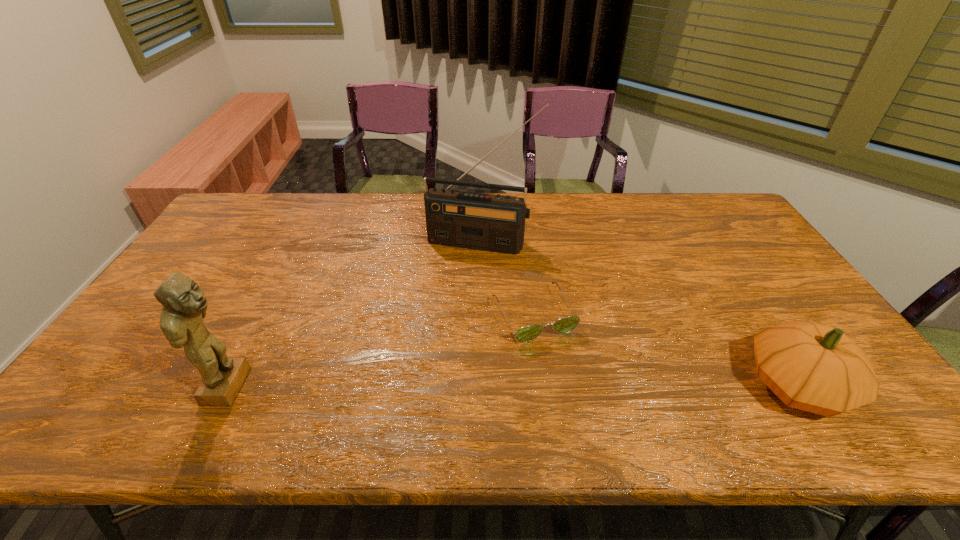
At what (x,y) coordinates should I click in order to perform the action: click on the leftmost object. Please return your answer as a coordinate pair (x, y). The width and height of the screenshot is (960, 540). Looking at the image, I should click on (184, 305).

Find the location of a particular element. This screenshot has width=960, height=540. figurine is located at coordinates (184, 305).

Find the location of a particular element. the second shortest object is located at coordinates (817, 368).

Find the location of a particular element. The width and height of the screenshot is (960, 540). gourd is located at coordinates click(817, 368).

Locate an element on the screen. The image size is (960, 540). the farthest object is located at coordinates (494, 223).

Find the location of a particular element. This screenshot has width=960, height=540. the tallest object is located at coordinates (494, 223).

Find the location of `sunglasses`. sunglasses is located at coordinates (564, 325).

At what (x,y) coordinates should I click in order to perform the action: click on the shortest object. Please return your answer as a coordinate pair (x, y). Image resolution: width=960 pixels, height=540 pixels. Looking at the image, I should click on (564, 325).

At what (x,y) coordinates should I click in order to perform the action: click on free space located 0.080m on the front-facing side of the leftmost object. Please return your answer as a coordinate pair (x, y). Looking at the image, I should click on (283, 386).

At what (x,y) coordinates should I click in order to perform the action: click on vacant region located on the side of the third tallest object with the carved face. Please return your answer as a coordinate pair (x, y). Looking at the image, I should click on (869, 385).